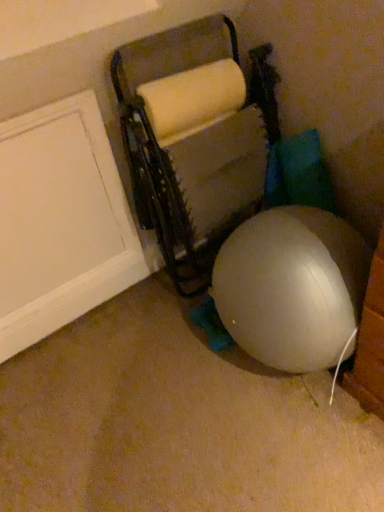
At what (x,y) coordinates should I click in order to perform the action: click on white matte door at left. Please return your answer as a coordinate pair (x, y). This screenshot has width=384, height=512. Looking at the image, I should click on (60, 222).

This screenshot has width=384, height=512. Describe the element at coordinates (60, 222) in the screenshot. I see `white matte door at left` at that location.

Describe the element at coordinates (185, 138) in the screenshot. I see `matte gray bean bag chair at center` at that location.

Measure the distance between matte gray bean bag chair at center and camera.

They are 4.28 feet apart.

Locate an element on the screen. matte gray bean bag chair at center is located at coordinates (185, 138).

You are a GUI agent. You are given a task and a screenshot of the screen. Output one action in this format:
    pyautogui.click(x=<x>, y=<y>)
    Task: Click on the white matte door at left
    The image size is (384, 512).
    Given the screenshot: What is the action you would take?
    pyautogui.click(x=60, y=222)

Does white matte door at left appear on the right side of matte gray bean bag chair at center?

Incorrect, white matte door at left is not on the right side of matte gray bean bag chair at center.

Which object is further away from the camera taking this photo, white matte door at left or matte gray bean bag chair at center?

white matte door at left is behind.

Between point (10, 227) and point (188, 81), which one is positioned in front?

The point (188, 81) is more forward.

From the image's perspective, which one is positioned lower, white matte door at left or matte gray bean bag chair at center?

white matte door at left.

From a real-world perspective, between white matte door at left and matte gray bean bag chair at center, who is vertically higher?

In real-world perspective, white matte door at left is above.

Can you confirm if white matte door at left is wider than matte gray bean bag chair at center?

No, white matte door at left is not wider than matte gray bean bag chair at center.

Considering the relative sizes of white matte door at left and matte gray bean bag chair at center in the image provided, is white matte door at left taller than matte gray bean bag chair at center?

No.

Which of these two, white matte door at left or matte gray bean bag chair at center, is smaller?

white matte door at left.

Consider the image. Would you say white matte door at left is inside or outside matte gray bean bag chair at center?

white matte door at left is spatially situated outside matte gray bean bag chair at center.

Is the surface of white matte door at left in direct contact with matte gray bean bag chair at center?

No, white matte door at left is not beside matte gray bean bag chair at center.

Is white matte door at left facing towards matte gray bean bag chair at center?

No, white matte door at left does not turn towards matte gray bean bag chair at center.

What's the angular difference between white matte door at left and matte gray bean bag chair at center's facing directions?

The angle between the facing direction of white matte door at left and the facing direction of matte gray bean bag chair at center is 1.97 degrees.

Find the location of a particular element. This screenshot has width=384, height=512. door that appears above the matte gray bean bag chair at center (from a real-world perspective) is located at coordinates (60, 222).

Is matte gray bean bag chair at center to the left or to the right of white matte door at left in the image?

matte gray bean bag chair at center is positioned on white matte door at left's right side.

Between matte gray bean bag chair at center and white matte door at left, which one is positioned behind?

Positioned behind is white matte door at left.

Which is closer, (185, 132) or (106, 155)?

Clearly, point (185, 132) is closer to the camera than point (106, 155).

From the image's perspective, is matte gray bean bag chair at center above white matte door at left?

Indeed, from the image's perspective, matte gray bean bag chair at center is shown above white matte door at left.

From a real-world perspective, which object stands above the other?

In real-world perspective, white matte door at left is above.

Can you confirm if matte gray bean bag chair at center is thinner than white matte door at left?

No, matte gray bean bag chair at center is not thinner than white matte door at left.

Between matte gray bean bag chair at center and white matte door at left, which one has less height?

Standing shorter between the two is white matte door at left.

Which of these two, matte gray bean bag chair at center or white matte door at left, is bigger?

matte gray bean bag chair at center is bigger.

Is matte gray bean bag chair at center outside of white matte door at left?

Yes, matte gray bean bag chair at center is outside of white matte door at left.

Is there a large distance between matte gray bean bag chair at center and white matte door at left?

matte gray bean bag chair at center is actually quite close to white matte door at left.

From the picture: Is matte gray bean bag chair at center oriented towards white matte door at left?

→ No, matte gray bean bag chair at center is not facing towards white matte door at left.

At what (x,y) coordinates should I click in order to perform the action: click on door behind the matte gray bean bag chair at center. Please return your answer as a coordinate pair (x, y). The image size is (384, 512). Looking at the image, I should click on (60, 222).

Where is `door that is above the matte gray bean bag chair at center (from a real-world perspective)`? The width and height of the screenshot is (384, 512). door that is above the matte gray bean bag chair at center (from a real-world perspective) is located at coordinates (60, 222).

You are a GUI agent. You are given a task and a screenshot of the screen. Output one action in this format:
    pyautogui.click(x=<x>, y=<y>)
    Task: Click on the door that appears on the left of matte gray bean bag chair at center
    The height and width of the screenshot is (512, 384).
    Given the screenshot: What is the action you would take?
    pyautogui.click(x=60, y=222)